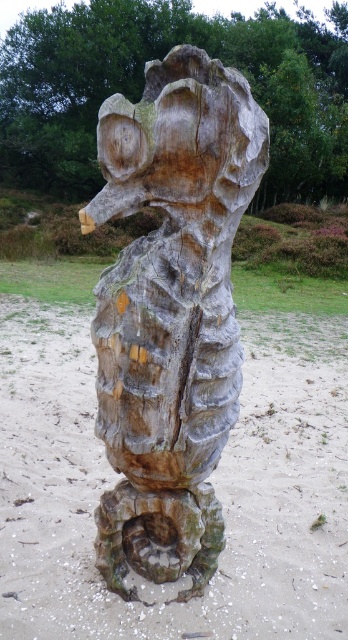
Question: Which point is farther to the camera?

Choices:
 (A) (125, 589)
 (B) (280, 474)

Answer: (B)

Question: Is brown wood at center above weathered wood sculpture at center?

Choices:
 (A) yes
 (B) no

Answer: (B)

Question: Is brown wood at center in front of weathered wood sculpture at center?

Choices:
 (A) yes
 (B) no

Answer: (B)

Question: In this image, where is brown wood at center located relative to weathered wood sculpture at center?

Choices:
 (A) right
 (B) left

Answer: (A)